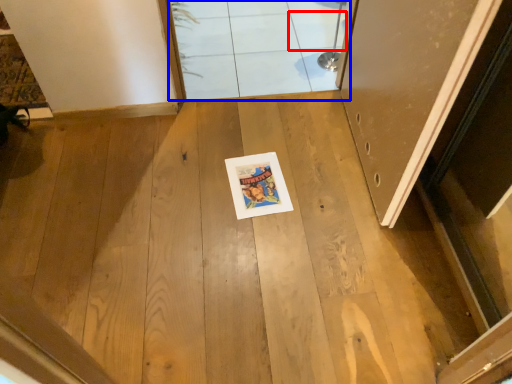
Question: Which object is further to the camera taking this photo, tile (highlighted by a red box) or window (highlighted by a blue box)?

Choices:
 (A) tile
 (B) window

Answer: (B)